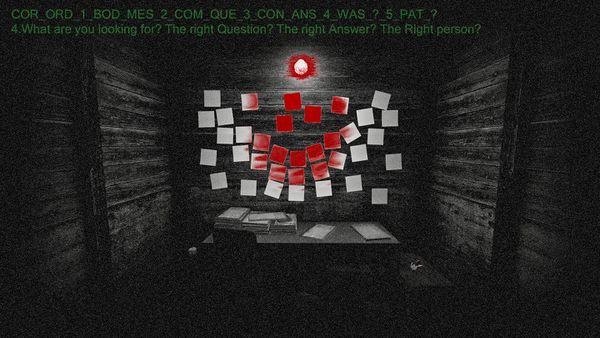
In order to click on black wooden horizontal wooden planks (wall background) in this screenshot , I will do `click(69, 189)`, `click(466, 179)`, `click(359, 81)`.